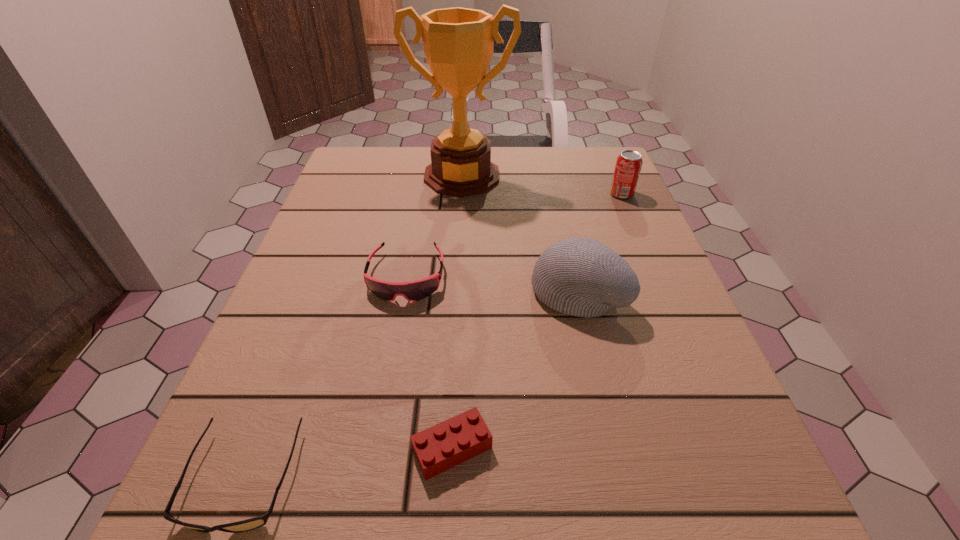
Identify the location of award. pos(458,43).

Where is `beanie`? This screenshot has width=960, height=540. beanie is located at coordinates (x=582, y=277).

Identify the location of the rightmost object. (629, 163).

You are a GUI agent. You are given a task and a screenshot of the screen. Output one action in this format:
    pyautogui.click(x=<x>, y=<y>)
    Task: Click on the fourth tallest object
    
    Given the screenshot: What is the action you would take?
    pyautogui.click(x=416, y=290)

Where is `Lego`? The image size is (960, 540). Lego is located at coordinates (447, 444).

Identify the location of free location located 0.100m on the front-facing side of the award. (459, 222).

You are a GUI agent. You are given a task and a screenshot of the screen. Output one action in this format:
    pyautogui.click(x=<x>, y=<y>)
    Task: Click on the vacant space located 0.250m on the front of the second object from right to left
    This screenshot has height=540, width=960.
    Given the screenshot: What is the action you would take?
    pyautogui.click(x=618, y=469)

I want to click on vacant space situated 0.140m on the front of the rightmost object, so click(x=640, y=237).

At what (x,y) coordinates should I click in order to perform the action: click on free space located on the front-facing side of the goggles. Please return your answer as a coordinate pair (x, y). This screenshot has height=540, width=960. Looking at the image, I should click on (385, 392).

Identify the location of free space located 0.350m on the back of the Lego. (461, 260).